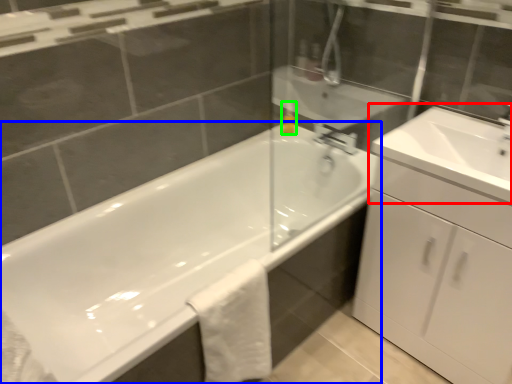
Question: Based on their relative distances, which object is nearer to sink (highlighted by a red box)? Choose from bathtub (highlighted by a blue box) and soap dispenser (highlighted by a green box).

Choices:
 (A) bathtub
 (B) soap dispenser

Answer: (B)